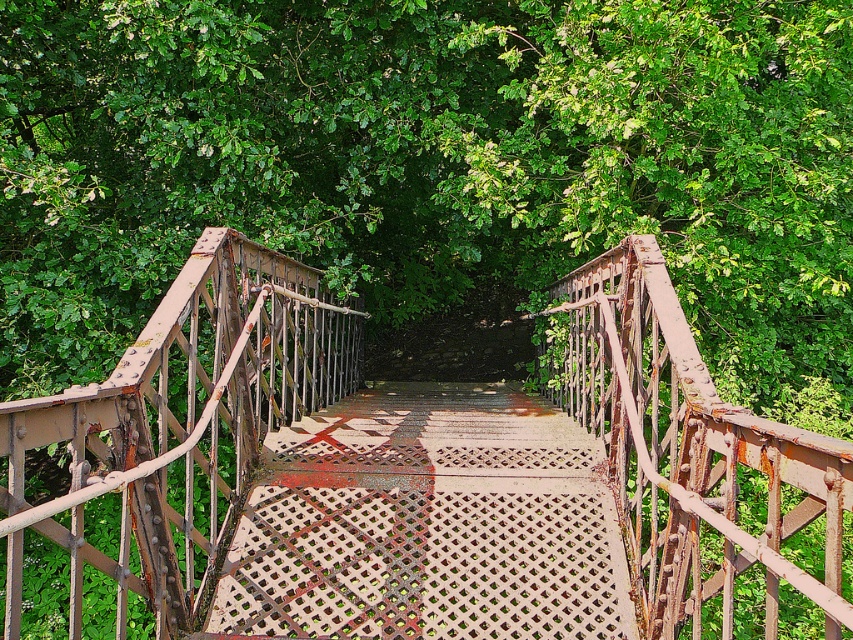
You are standing at the point marked by coordinates point (421, 477) in the image. What structure are you currently on?

The point (421, 477) marks the rusty metal bridge at center, so you are standing on the rusty metal bridge at center.

You are standing on the walkway of the rusty metal bridge at center and want to go down to the ground level. Which direction should you head towards to locate the rusty metal staircase at center?

The rusty metal bridge at center is in front of the rusty metal staircase at center, so to locate the rusty metal staircase at center, you should head towards the direction where the bridge is not blocking your view, which would be behind the rusty metal bridge at center.

You are a maintenance worker needing to inspect both the rusty metal bridge at center and the rusty metal staircase at center. Which structure should you check first if you want to start from the lower level and move upwards?

You should start with the rusty metal staircase at center because the rusty metal bridge at center is positioned over it, meaning the staircase is below the bridge and closer to the lower level.